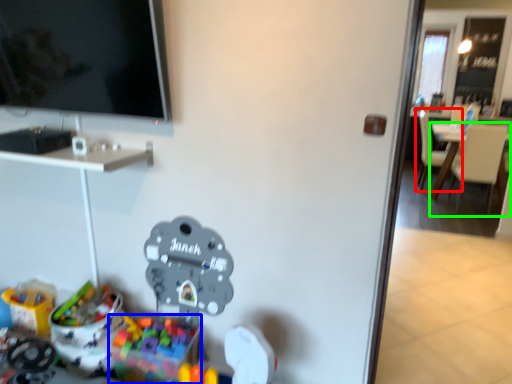
Question: Which is nearer to the chair (highlighted by a red box)? toy (highlighted by a blue box) or chair (highlighted by a green box).

Choices:
 (A) toy
 (B) chair

Answer: (B)